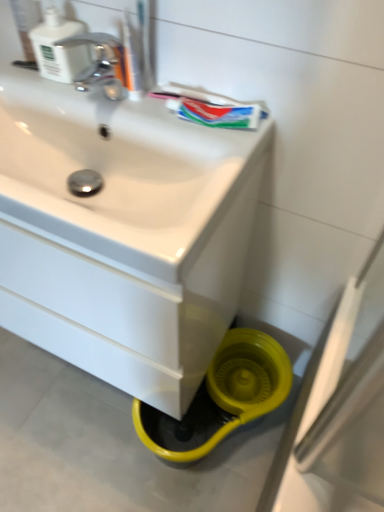
Find the location of a particular element. vacant space in front of green matte toothpaste at upper center is located at coordinates (218, 156).